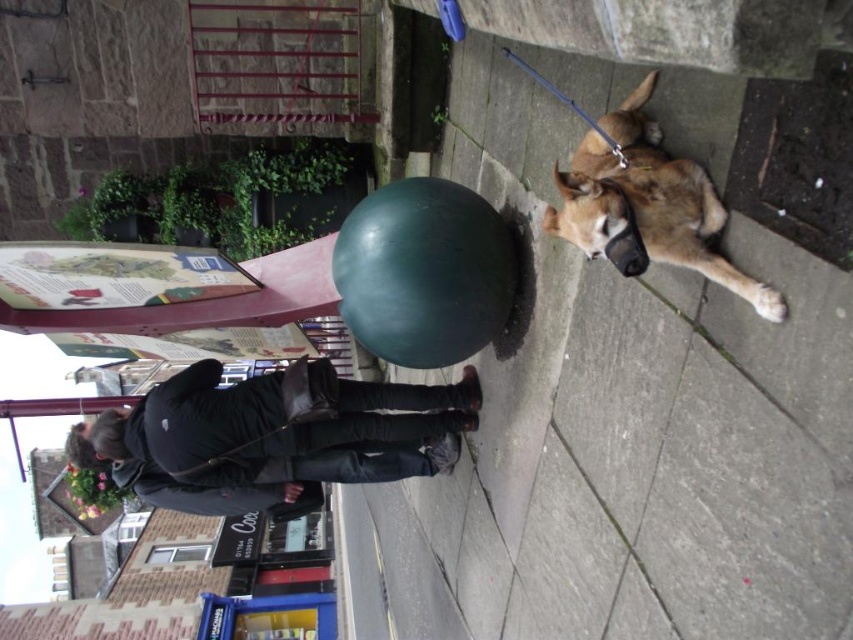
You are a delivery robot trying to navigate through the sidewalk. You see the dark gray leather jacket at center and the brown fur dog at right. Which object is closer to the ground?

The dark gray leather jacket at center is positioned under brown fur dog at right, so the dark gray leather jacket at center is closer to the ground.

You are a delivery robot that needs to navigate between the dark gray leather jacket at center and the brown fur dog at right. The minimum safe distance for your operation is 10 feet. Can you safely pass between them?

The dark gray leather jacket at center is 10.42 feet from the brown fur dog at right, so yes, the delivery robot can safely pass between them since the distance is greater than the required 10 feet minimum.

You are standing at the point marked as point (x=283, y=432). What object are you currently standing on?

You are standing on the dark gray leather jacket at center.